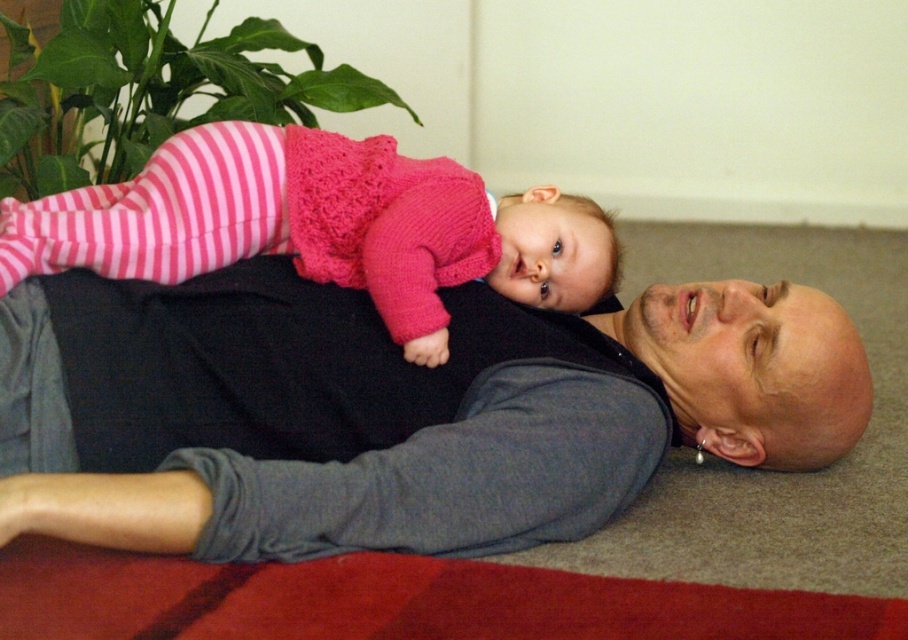
You are a photographer setting up for a family photo shoot. You need to ensure that the gray soft shirt at center and the pink knitted sweater at upper center are both visible in the frame. Based on their sizes, which one might you need to adjust your camera angle to include more of?

The gray soft shirt at center is taller than the pink knitted sweater at upper center, so you might need to adjust the camera angle to include more of the gray soft shirt at center to ensure it is fully visible.

In the scene shown: You are a tailor measuring clothing items in the image. The gray soft shirt at center and the pink knitted sweater at upper center are part of the man and baby outfit. Can you determine if the distance between them is sufficient to allow a 6.5 inch long measuring tape to fit between them without bending?

The gray soft shirt at center and pink knitted sweater at upper center are 6.27 inches apart from each other. Since the measuring tape is 6.5 inches long, it is slightly longer than the space between them. Therefore, the measuring tape cannot fit straight between them without bending.